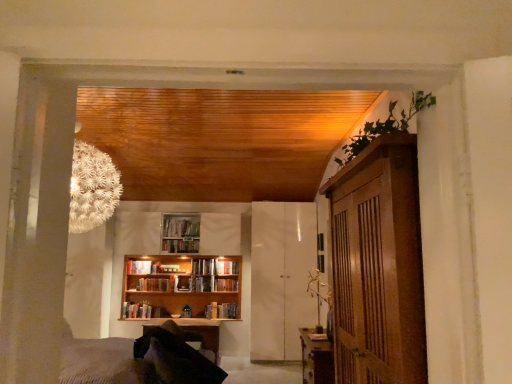
Question: In the image, is wooden bookcase at center on the left side or the right side of wooden bookshelf at center, positioned as the 5th book in top-to-bottom order?

Choices:
 (A) right
 (B) left

Answer: (A)

Question: Is point [181, 281] positioned closer to the camera than point [146, 286]?

Choices:
 (A) farther
 (B) closer

Answer: (A)

Question: Estimate the real-world distances between objects in this image. Which object is farther from the wooden bookshelf at center, which is the 1th book in top-to-bottom order?

Choices:
 (A) hardcover book at center, positioned as the third book in bottom-to-top order
 (B) wooden bookcase at center
 (C) wooden bookshelf at center, positioned as the 5th book in top-to-bottom order
 (D) hardcover book at center, marked as the 5th book in a bottom-to-top arrangement
 (E) white glossy cabinet at center

Answer: (E)

Question: Based on their relative distances, which object is farther from the wooden bookshelf at center, acting as the 6th book starting from the top?

Choices:
 (A) wooden bookshelf at center, positioned as the second book in bottom-to-top order
 (B) hardcover book at center, the 4th book ordered from the bottom
 (C) wooden bookshelf at center, which is the sixth book from bottom to top
 (D) wooden table at right, positioned as the 1th table in top-to-bottom order
 (E) hardcover book at center, arranged as the fourth book when viewed from the top

Answer: (D)